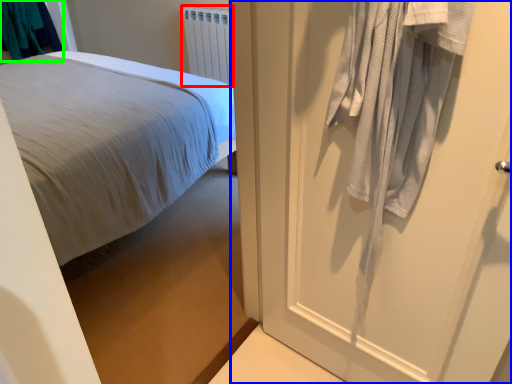
Question: Estimate the real-world distances between objects in this image. Which object is closer to radiator (highlighted by a red box), door (highlighted by a blue box) or laundry (highlighted by a green box)?

Choices:
 (A) door
 (B) laundry

Answer: (B)